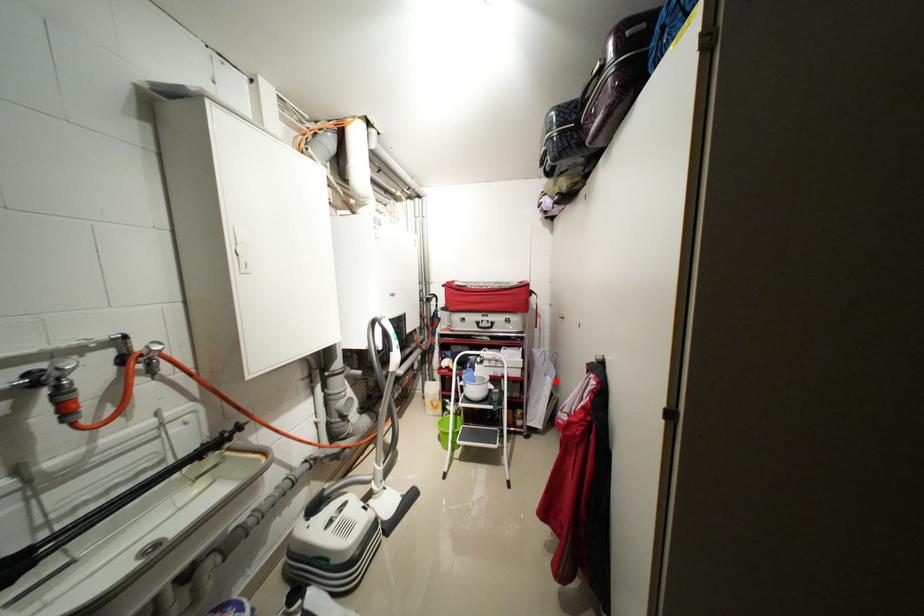
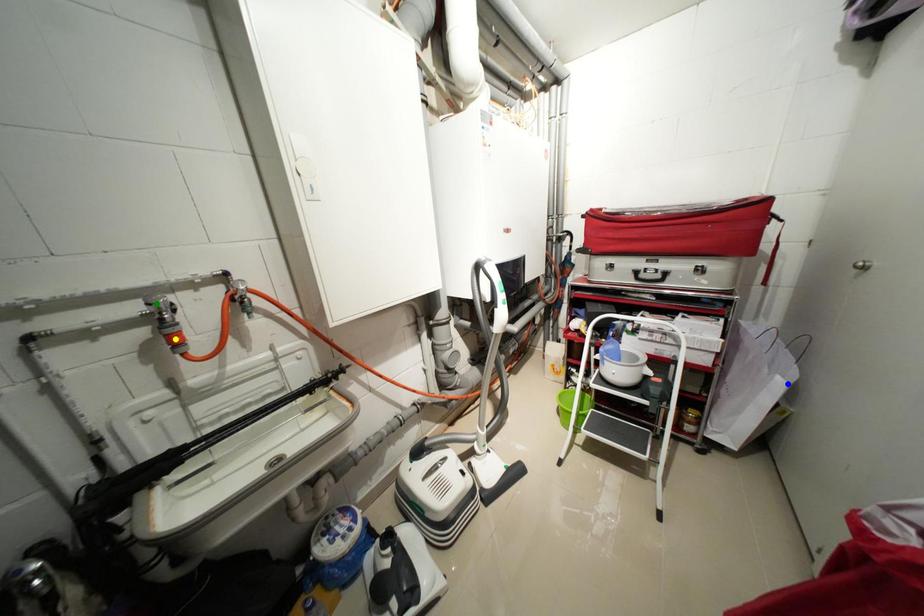
Question: I am providing you with two images of the same scene from different viewpoints. A red point is marked on the first image. You are given multiple points on the second image. Which point in image 2 represents the same 3d spot as the red point in image 1?

Choices:
 (A) green point
 (B) blue point
 (C) yellow point

Answer: (B)